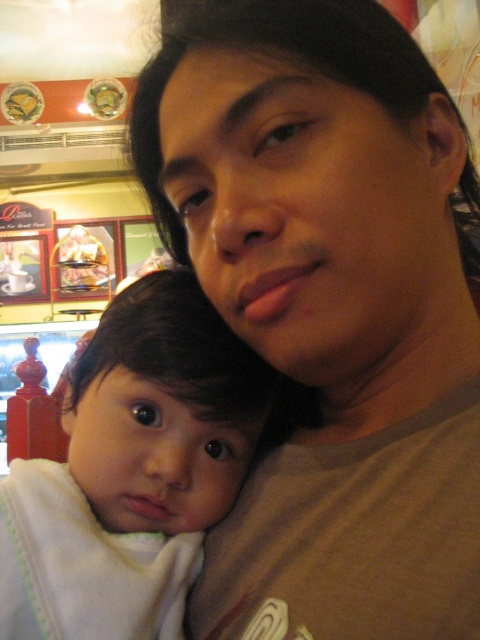
Question: Among these points, which one is farthest from the camera?

Choices:
 (A) (225, 401)
 (B) (271, 138)

Answer: (A)

Question: Is matte brown shirt at center further to camera compared to white soft baby at center?

Choices:
 (A) yes
 (B) no

Answer: (B)

Question: Is matte brown shirt at center to the right of white soft baby at center from the viewer's perspective?

Choices:
 (A) yes
 (B) no

Answer: (A)

Question: Does matte brown shirt at center appear over white soft baby at center?

Choices:
 (A) no
 (B) yes

Answer: (B)